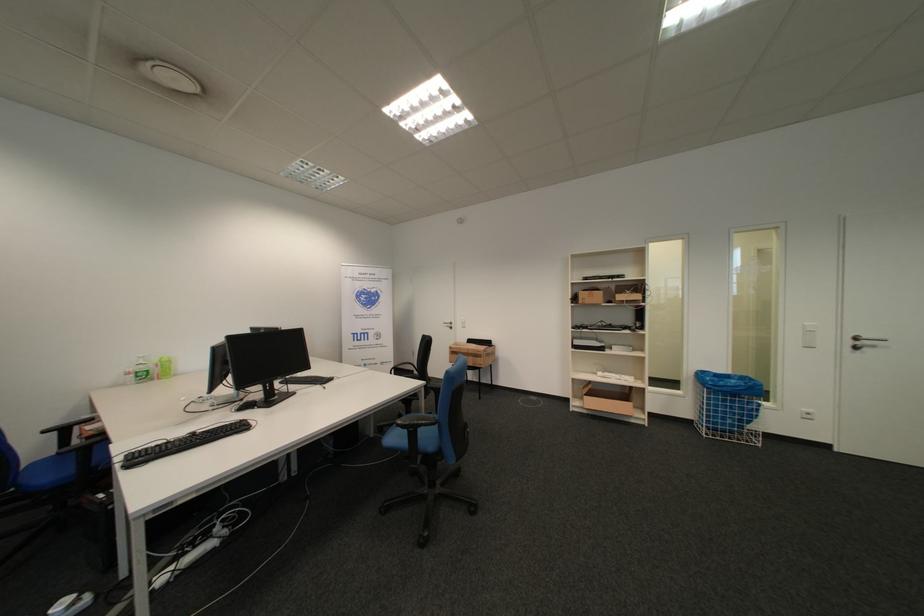
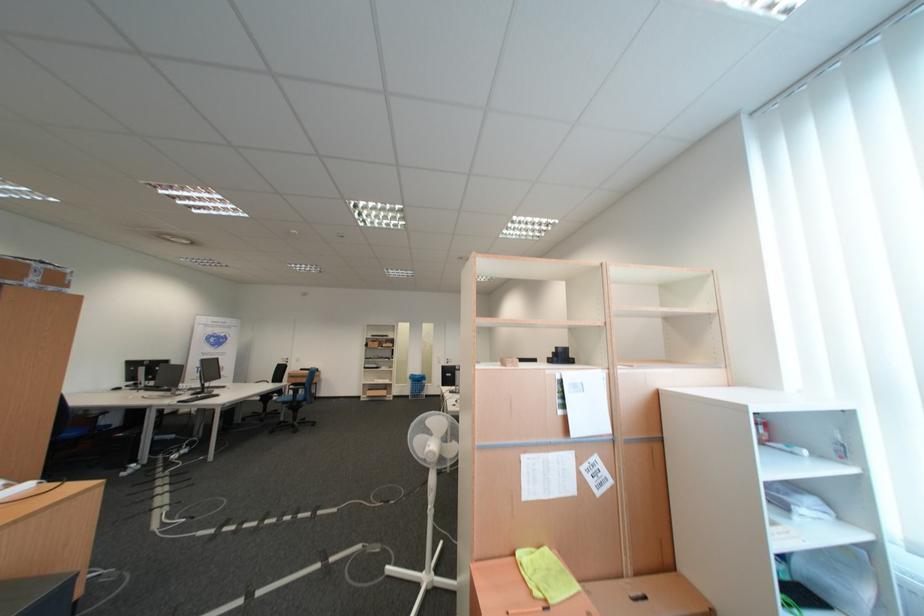
Find the pixel in the second image that matches the point at 720,424 in the first image.

(422, 394)